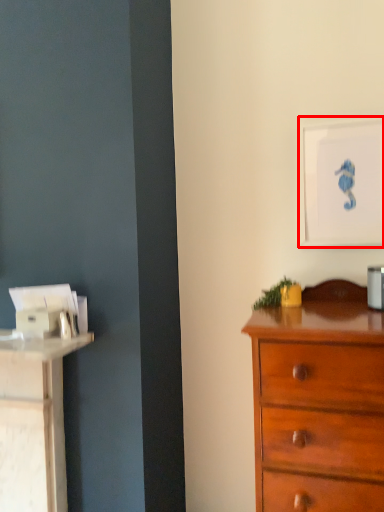
Question: Considering the relative positions of picture frame (annotated by the red box) and chest of drawers in the image provided, where is picture frame (annotated by the red box) located with respect to the staircase?

Choices:
 (A) left
 (B) right

Answer: (B)